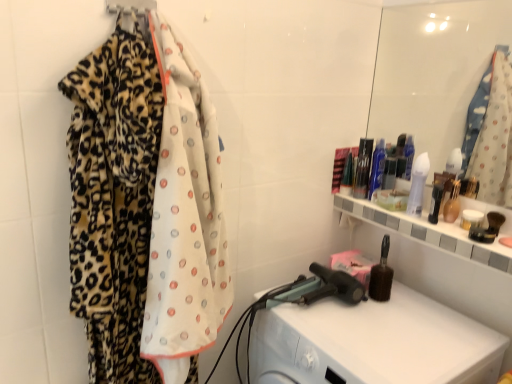
Question: Is white glossy lotion at upper right, the fourth toiletry from the right, shorter than leopard print fabric at upper left?

Choices:
 (A) yes
 (B) no

Answer: (B)

Question: From a real-world perspective, is white glossy lotion at upper right, the fourth toiletry from the right, over leopard print fabric at upper left?

Choices:
 (A) yes
 (B) no

Answer: (B)

Question: From a real-world perspective, is white glossy lotion at upper right, the fourth toiletry from the right, under leopard print fabric at upper left?

Choices:
 (A) yes
 (B) no

Answer: (A)

Question: Is white glossy lotion at upper right, the fourth toiletry from the right, far from leopard print fabric at upper left?

Choices:
 (A) no
 (B) yes

Answer: (A)

Question: Is white glossy lotion at upper right, the fourth toiletry from the right, at the left side of leopard print fabric at upper left?

Choices:
 (A) no
 (B) yes

Answer: (A)

Question: From a real-world perspective, is white glossy jar at upper right, acting as the 8th toiletry starting from the left, physically located above or below leopard print fabric at left?

Choices:
 (A) below
 (B) above

Answer: (B)

Question: Is white glossy jar at upper right, which is the first toiletry from right to left, in front of or behind leopard print fabric at left in the image?

Choices:
 (A) front
 (B) behind

Answer: (B)

Question: Based on their sizes in the image, would you say white glossy jar at upper right, acting as the 8th toiletry starting from the left, is bigger or smaller than leopard print fabric at left?

Choices:
 (A) small
 (B) big

Answer: (A)

Question: Is point (463, 216) closer or farther from the camera than point (181, 281)?

Choices:
 (A) closer
 (B) farther

Answer: (B)

Question: From their relative heights in the image, would you say translucent glass vase at upper right, the 2th toiletry when ordered from right to left, is taller or shorter than white glossy lotion at upper right, the 5th toiletry from the left?

Choices:
 (A) tall
 (B) short

Answer: (B)

Question: Considering the relative positions of translucent glass vase at upper right, placed as the seventh toiletry when sorted from left to right, and white glossy lotion at upper right, the fourth toiletry from the right, in the image provided, is translucent glass vase at upper right, placed as the seventh toiletry when sorted from left to right, to the left or to the right of white glossy lotion at upper right, the fourth toiletry from the right,?

Choices:
 (A) left
 (B) right

Answer: (B)

Question: Is point (443, 210) closer or farther from the camera than point (406, 210)?

Choices:
 (A) closer
 (B) farther

Answer: (A)

Question: Looking at the image, does translucent glass vase at upper right, the 2th toiletry when ordered from right to left, seem bigger or smaller compared to white glossy lotion at upper right, the fourth toiletry from the right?

Choices:
 (A) small
 (B) big

Answer: (A)

Question: Is blue glossy bottle at upper right, arranged as the fifth toiletry when viewed from the right, spatially inside translucent glass vase at upper right, the 2th toiletry when ordered from right to left, or outside of it?

Choices:
 (A) inside
 (B) outside

Answer: (B)

Question: Is blue glossy bottle at upper right, marked as the 4th toiletry in a left-to-right arrangement, bigger or smaller than translucent glass vase at upper right, the 2th toiletry when ordered from right to left?

Choices:
 (A) big
 (B) small

Answer: (A)